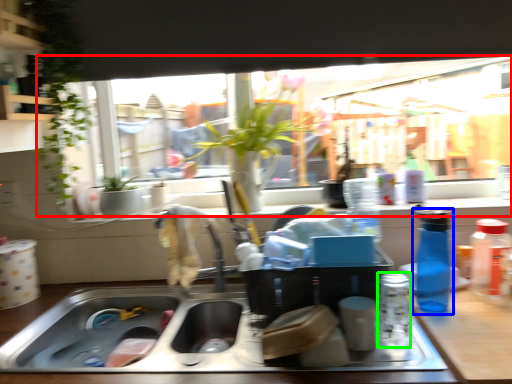
Question: Estimate the real-world distances between objects in this image. Which object is closer to window (highlighted by a red box), bottle (highlighted by a blue box) or bottle (highlighted by a green box)?

Choices:
 (A) bottle
 (B) bottle

Answer: (A)